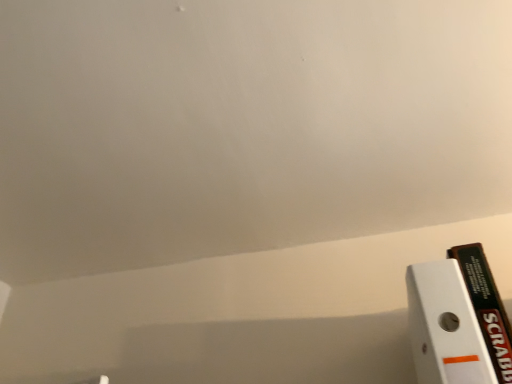
Question: Does black cardboard book at right have a greater width compared to white matte paper at lower right?

Choices:
 (A) no
 (B) yes

Answer: (B)

Question: Is white matte paper at lower right located within black cardboard book at right?

Choices:
 (A) yes
 (B) no

Answer: (B)

Question: From the image's perspective, would you say black cardboard book at right is positioned over white matte paper at lower right?

Choices:
 (A) yes
 (B) no

Answer: (B)

Question: Does black cardboard book at right come behind white matte paper at lower right?

Choices:
 (A) no
 (B) yes

Answer: (B)

Question: Is black cardboard book at right at the right side of white matte paper at lower right?

Choices:
 (A) no
 (B) yes

Answer: (B)

Question: From a real-world perspective, is black cardboard book at right beneath white matte paper at lower right?

Choices:
 (A) yes
 (B) no

Answer: (B)

Question: Can you confirm if white matte paper at lower right is positioned to the right of black cardboard book at right?

Choices:
 (A) no
 (B) yes

Answer: (A)

Question: From the image's perspective, is white matte paper at lower right above black cardboard book at right?

Choices:
 (A) no
 (B) yes

Answer: (B)

Question: Can you confirm if white matte paper at lower right is shorter than black cardboard book at right?

Choices:
 (A) yes
 (B) no

Answer: (A)

Question: From a real-world perspective, is white matte paper at lower right under black cardboard book at right?

Choices:
 (A) yes
 (B) no

Answer: (A)

Question: Does white matte paper at lower right lie behind black cardboard book at right?

Choices:
 (A) no
 (B) yes

Answer: (A)

Question: Is white matte paper at lower right wider than black cardboard book at right?

Choices:
 (A) no
 (B) yes

Answer: (A)

Question: From a real-world perspective, is black cardboard book at right physically located above or below white matte paper at lower right?

Choices:
 (A) below
 (B) above

Answer: (B)